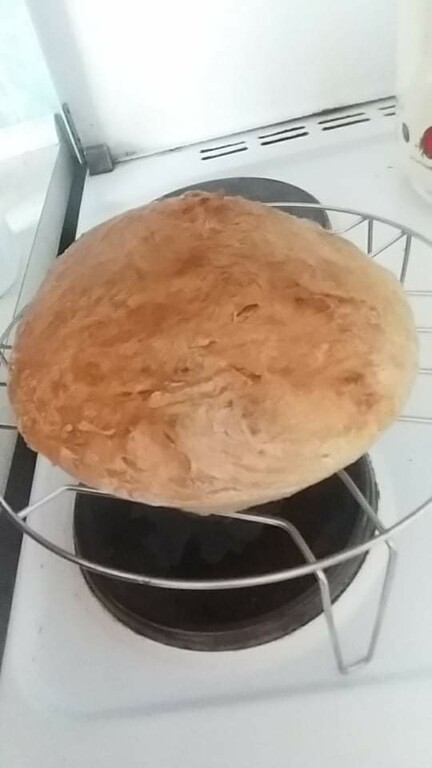
Locate an element on the screen. This screenshot has width=432, height=768. wire rack is located at coordinates (340, 557), (370, 220).